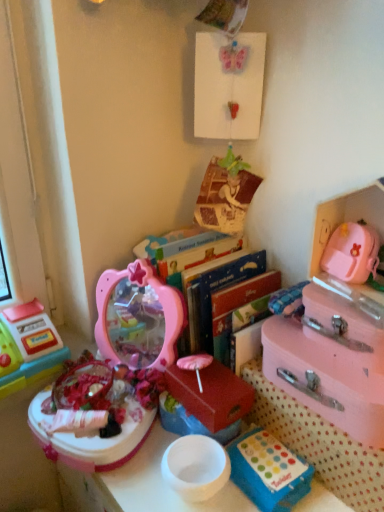
Question: Looking at the image, does pastel pink suitcase at right, the 2th storage box viewed from the right, seem bigger or smaller compared to pink plastic mirror at center, placed as the second toy when sorted from left to right?

Choices:
 (A) big
 (B) small

Answer: (B)

Question: In the image, is pastel pink suitcase at right, which is the third storage box in left-to-right order, positioned in front of or behind pink plastic mirror at center, the 1th toy positioned from the right?

Choices:
 (A) behind
 (B) front

Answer: (A)

Question: Estimate the real-world distances between objects in this image. Which object is farther from the blue plastic storage box at lower center, the 2th storage box positioned from the left?

Choices:
 (A) pastel pink suitcase at right, which is the third storage box in left-to-right order
 (B) hardcover books at center
 (C) matte red box at center, the 1th storage box in the left-to-right sequence
 (D) pink plastic mirror at center, the 1th toy positioned from the right
 (E) pink matte suitcase at right, the 4th storage box positioned from the left

Answer: (D)

Question: Which object is the closest to the pink plastic mirror at center, the 1th toy positioned from the right?

Choices:
 (A) plastic toy cash register at left, the first toy in the left-to-right sequence
 (B) pastel pink suitcase at right, the 2th storage box viewed from the right
 (C) matte red box at center, the 1th storage box in the left-to-right sequence
 (D) pink matte suitcase at right, which appears as the 1th storage box when viewed from the right
 (E) hardcover books at center

Answer: (E)